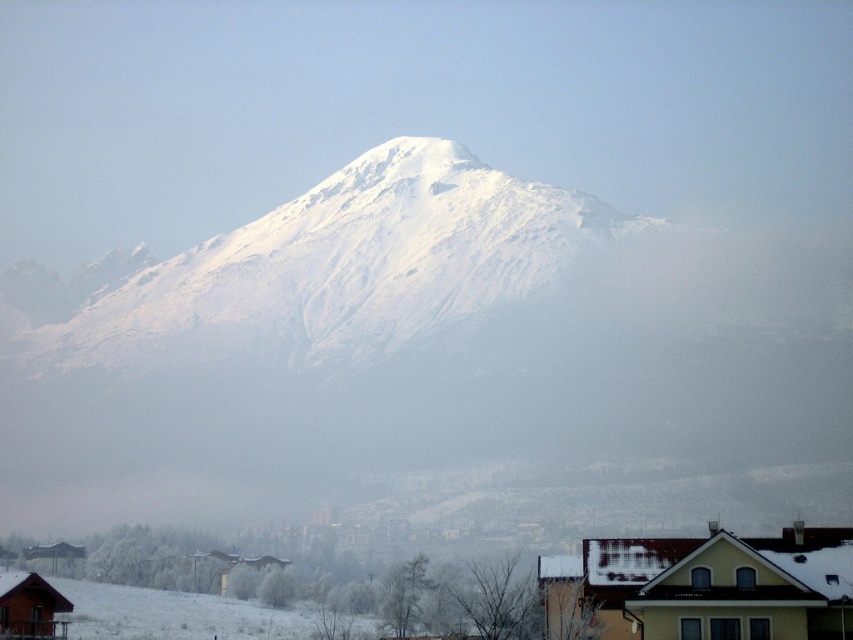
You are planning to deliver a package to both the yellow matte house at lower right and the wooden cabin at lower left. Based on the scene, which location is higher in elevation?

The yellow matte house at lower right is located above the wooden cabin at lower left, so it is higher in elevation.

You are an architect evaluating the winter landscape. You need to determine which structure is taller between the yellow matte house at lower right and the wooden cabin at lower left. Based on the scene description, which one is taller?

The yellow matte house at lower right is taller than the wooden cabin at lower left according to the description.

You are standing in the winter landscape and want to determine the relative positions of two points marked in the image. Which point is closer to you, point (701,579) or point (0,577)?

Point (701,579) is closer to the camera than point (0,577).